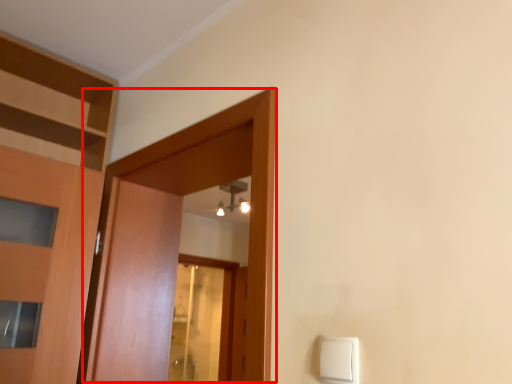
Question: Considering the relative positions of door (annotated by the red box) and light switch in the image provided, where is door (annotated by the red box) located with respect to the staircase?

Choices:
 (A) left
 (B) right

Answer: (A)